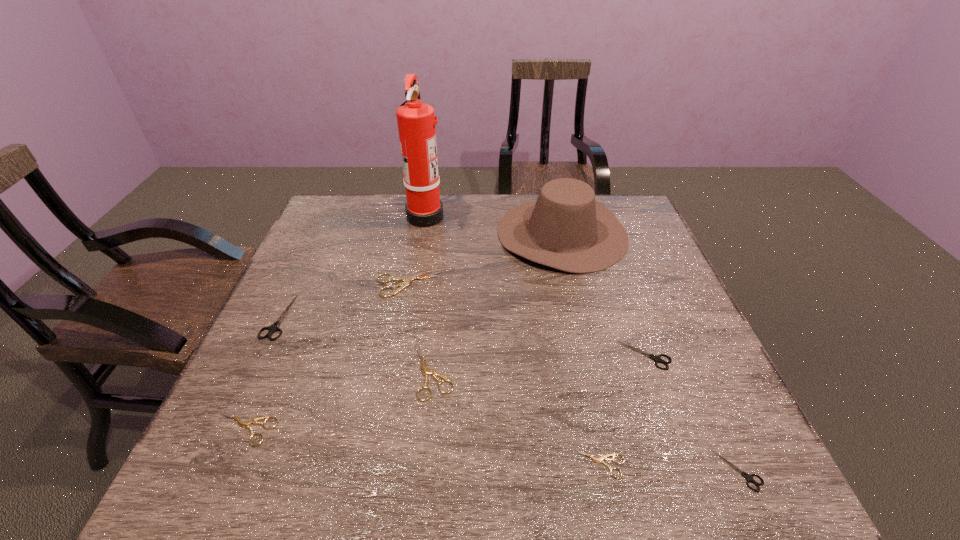
Find the location of a particular element. The width and height of the screenshot is (960, 540). vacant area that lies between the second black shears from right to left and the third smallest beige shears is located at coordinates (539, 363).

Identify the location of blank region between the red fire extinguisher and the rightmost shears. click(x=582, y=343).

Identify the location of free spot between the third biggest beige shears and the rightmost shears. The width and height of the screenshot is (960, 540). (492, 449).

You are a GUI agent. You are given a task and a screenshot of the screen. Output one action in this format:
    pyautogui.click(x=<x>, y=<y>)
    Task: Click on the free spot between the shortest shears and the fire extinguisher
    The height and width of the screenshot is (540, 960).
    Given the screenshot: What is the action you would take?
    pyautogui.click(x=513, y=340)

The image size is (960, 540). What are the coordinates of `vacant space in between the biggest black shears and the tallest object` in the screenshot? It's located at (351, 266).

Identify the location of object identified as the sixth closest to the third shears from right to left. Image resolution: width=960 pixels, height=540 pixels. (244, 424).

Locate an element on the screen. object that is the seventh closest to the leftmost black shears is located at coordinates (657, 358).

This screenshot has height=540, width=960. What are the coordinates of `shears that is the fourth nearest to the biggest black shears` in the screenshot? It's located at (599, 460).

This screenshot has width=960, height=540. What are the coordinates of `the closest shears relative to the brown cowboy hat` in the screenshot? It's located at (407, 280).

At what (x,y) coordinates should I click in order to perform the action: click on black shears object that ranks as the closest to the smallest black shears. Please return your answer as a coordinate pair (x, y). Looking at the image, I should click on [x=657, y=358].